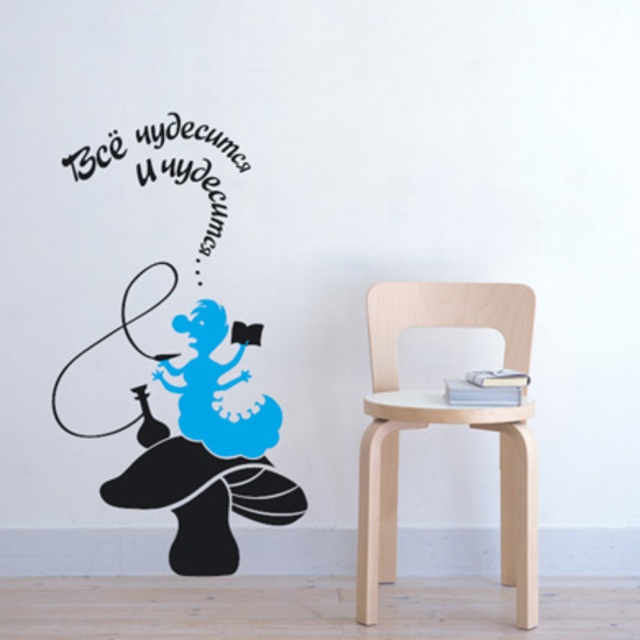
Between birch wood chair at right and blue matte figure at upper left, which one has more height?

With more height is birch wood chair at right.

Measure the distance between birch wood chair at right and camera.

birch wood chair at right and camera are 7.01 feet apart from each other.

Identify the location of birch wood chair at right. (444, 422).

Does blue matte figure at upper left appear on the left side of black vinyl text at upper left?

No, blue matte figure at upper left is not to the left of black vinyl text at upper left.

Measure the distance between blue matte figure at upper left and black vinyl text at upper left.

blue matte figure at upper left and black vinyl text at upper left are 16.22 inches apart.

Is point (180, 428) positioned before point (109, 138)?

No, (180, 428) is behind (109, 138).

Where is `blue matte figure at upper left`? This screenshot has height=640, width=640. blue matte figure at upper left is located at coordinates (205, 454).

Is birch wood chair at right further to camera compared to black vinyl text at upper left?

That is False.

Which is behind, point (520, 627) or point (212, 144)?

Positioned behind is point (212, 144).

This screenshot has height=640, width=640. I want to click on birch wood chair at right, so click(x=444, y=422).